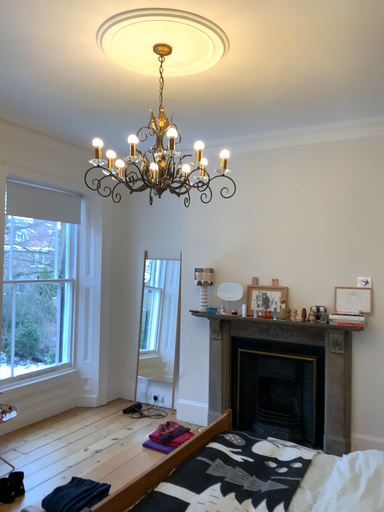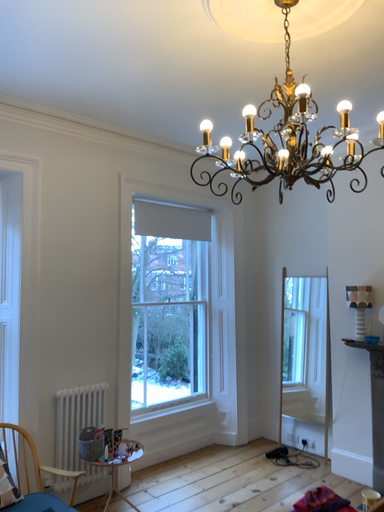
Question: Which way did the camera rotate in the video?

Choices:
 (A) rotated left
 (B) rotated right

Answer: (A)